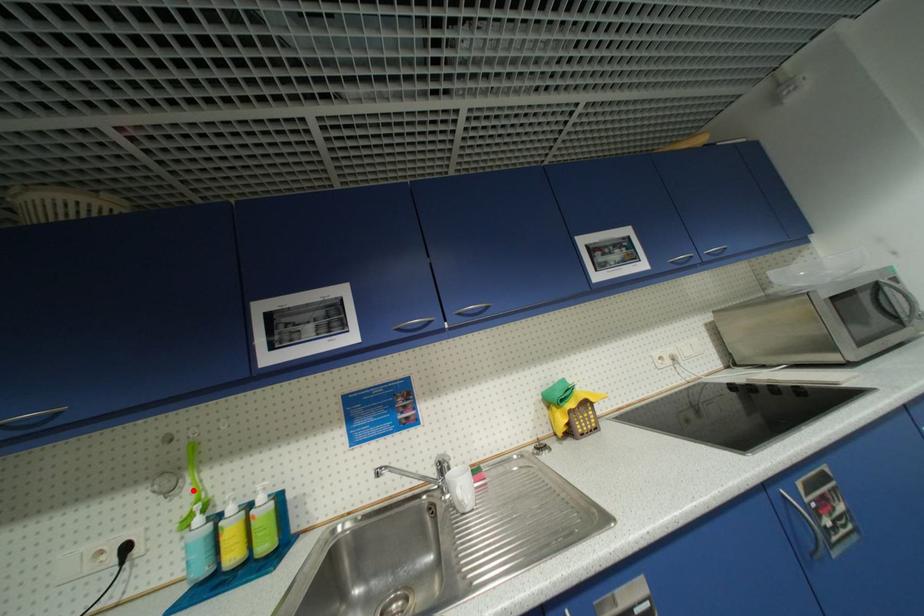
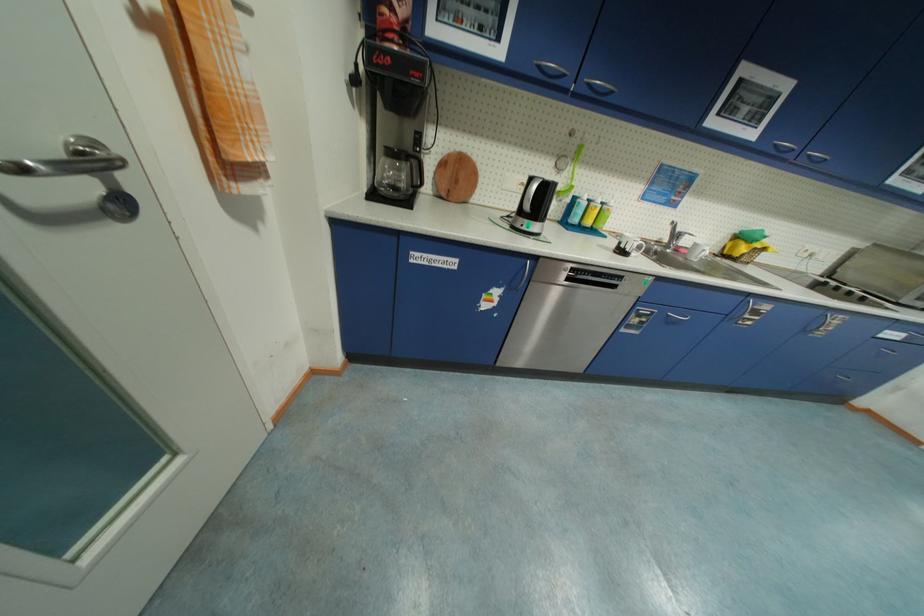
Question: I am providing you with two images of the same scene from different viewpoints. Image1 has a red point marked. In image2, the corresponding 3D location appears at what relative position? Reply with the corresponding letter.

Choices:
 (A) Closer
 (B) Farther

Answer: (A)